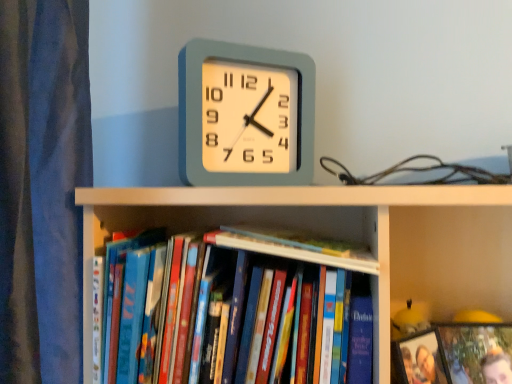
Question: Is matte plastic photo frame at lower right, which ranks as the first book in right-to-left order, taller or shorter than wooden photo frame at lower right?

Choices:
 (A) short
 (B) tall

Answer: (B)

Question: Which is correct: matte plastic photo frame at lower right, the third book when ordered from left to right, is inside wooden photo frame at lower right, or outside of it?

Choices:
 (A) outside
 (B) inside

Answer: (A)

Question: Based on their relative distances, which object is farther from the hardcover book at center, which is the second book in right-to-left order?

Choices:
 (A) hardcover books at center, which is counted as the third book, starting from the right
 (B) hardcover book at left
 (C) matte plastic photo frame at lower right, which ranks as the first book in right-to-left order
 (D) wooden photo frame at lower right
 (E) matte plastic clock at center

Answer: (B)

Question: Which of these objects is positioned closest to the matte plastic clock at center?

Choices:
 (A) hardcover books at center, marked as the 1th book in a left-to-right arrangement
 (B) matte plastic photo frame at lower right, the third book when ordered from left to right
 (C) hardcover book at left
 (D) hardcover book at center, which is the second book in right-to-left order
 (E) wooden photo frame at lower right

Answer: (D)